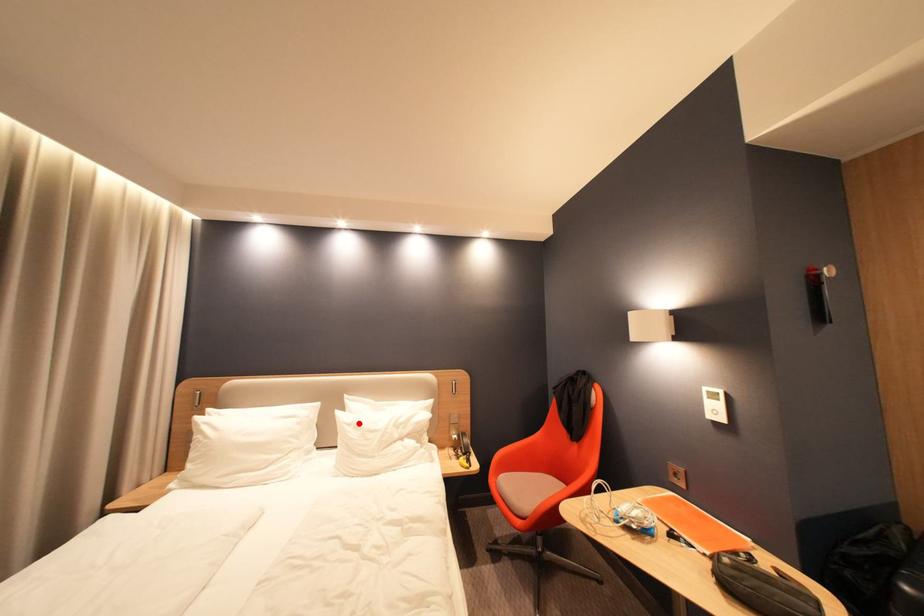
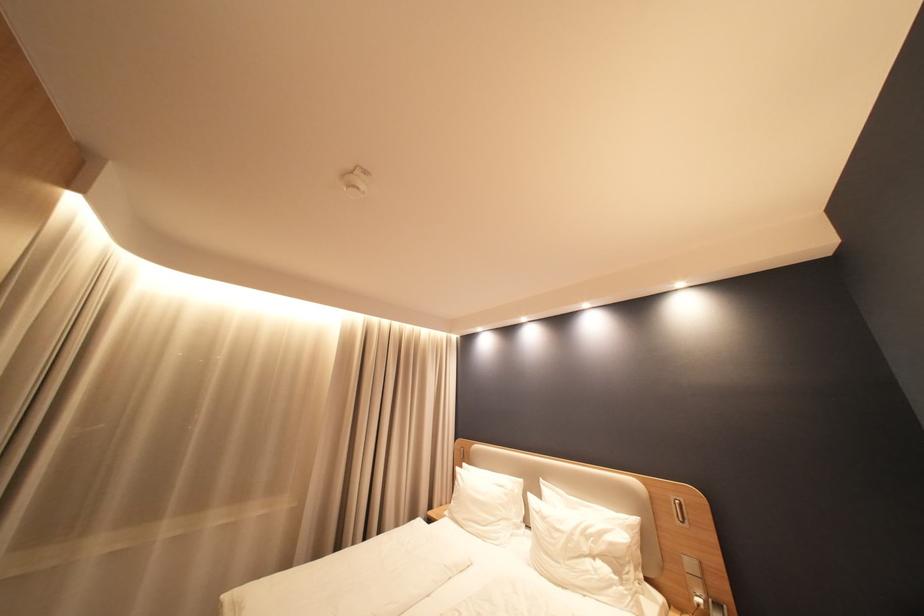
Find the pixel in the second image that matches the highlighted location in the first image.

(546, 511)